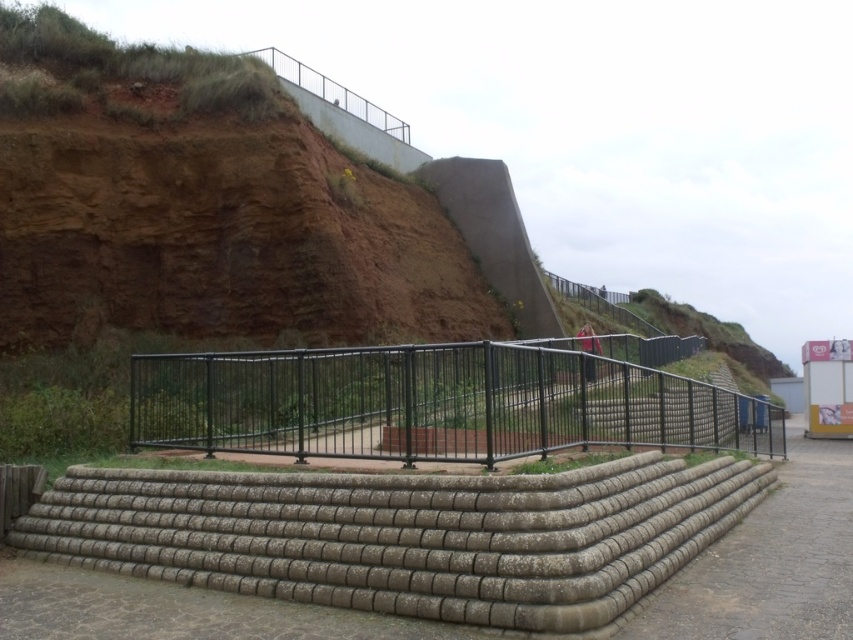
How distant is concrete textured stairs at center from black metal fence at center?

A distance of 3.20 meters exists between concrete textured stairs at center and black metal fence at center.

Which is in front, point (155, 496) or point (289, 426)?

Positioned in front is point (155, 496).

Find the location of a particular element. The width and height of the screenshot is (853, 640). concrete textured stairs at center is located at coordinates (405, 536).